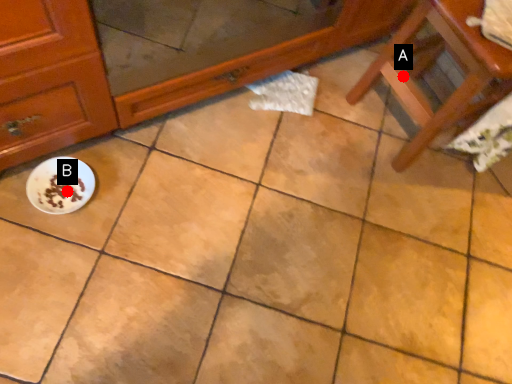
Question: Two points are circled on the image, labeled by A and B beside each circle. Which of the following is the closest to the observer?

Choices:
 (A) A is closer
 (B) B is closer

Answer: (B)